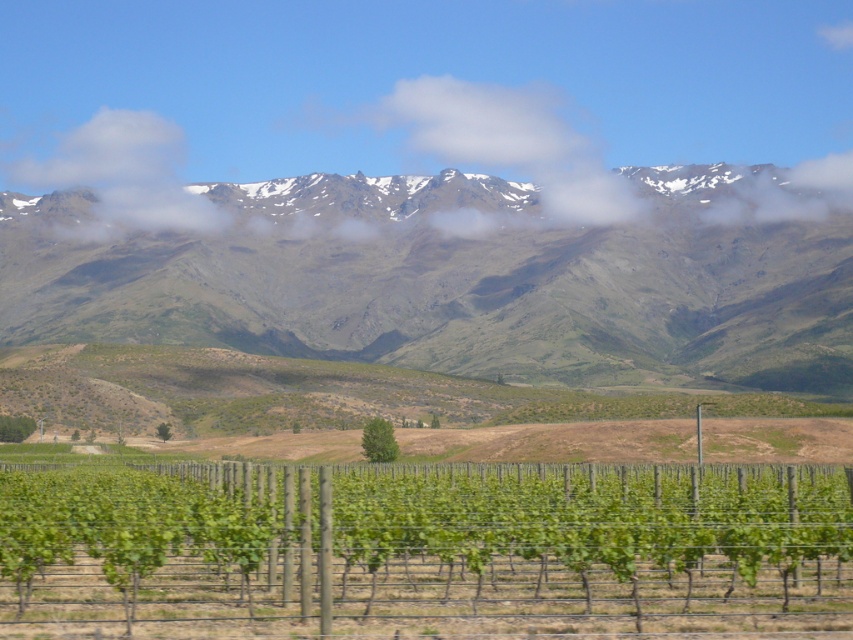
Can you confirm if green grassy mountain range at upper center is positioned to the right of green leafy vine at center?

Indeed, green grassy mountain range at upper center is positioned on the right side of green leafy vine at center.

Can you confirm if green grassy mountain range at upper center is positioned to the left of green leafy vine at center?

No, green grassy mountain range at upper center is not to the left of green leafy vine at center.

Between point (350, 250) and point (428, 502), which one is positioned in front?

Point (428, 502)

Find the location of `green grassy mountain range at upper center`. green grassy mountain range at upper center is located at coordinates (451, 278).

Looking at this image, is green leafy vine at center above snowy mountain range at upper center?

No, green leafy vine at center is not above snowy mountain range at upper center.

Is green leafy vine at center positioned before snowy mountain range at upper center?

That is True.

At what (x,y) coordinates should I click in order to perform the action: click on green leafy vine at center. Please return your answer as a coordinate pair (x, y). The height and width of the screenshot is (640, 853). Looking at the image, I should click on (424, 548).

Is green grassy mountain range at upper center taller than snowy mountain range at upper center?

In fact, green grassy mountain range at upper center may be shorter than snowy mountain range at upper center.

Is point (651, 342) less distant than point (225, 96)?

Yes, point (651, 342) is closer to viewer.

Find the location of a particular element. The height and width of the screenshot is (640, 853). green grassy mountain range at upper center is located at coordinates (451, 278).